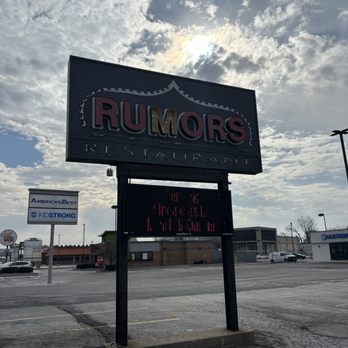
Image resolution: width=348 pixels, height=348 pixels. I want to click on windows, so click(x=146, y=257), click(x=137, y=258).